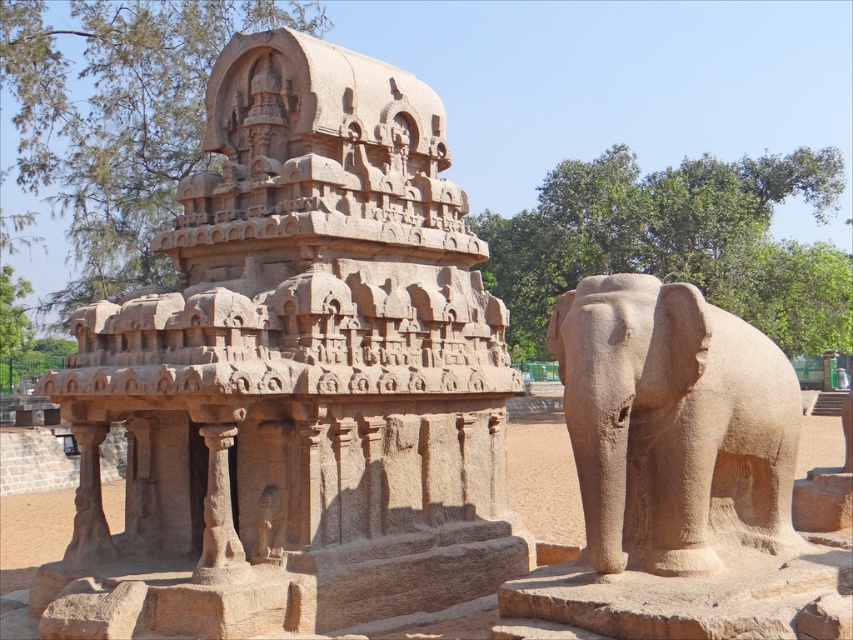
You are an archaeologist examining the ancient stone structures. You notice the sandy stone temple at center and the sandy stone elephant at right. Which structure is closer to your current position?

The sandy stone temple at center is closer to your current position because it is further to the viewer than the sandy stone elephant at right, meaning it appears nearer in the scene.

Consider the image. You are an archaeologist examining the ancient site. You need to place a protective barrier between the sandy stone temple at center and the sandy stone elephant at right. Based on their positions, which direction should the barrier be placed relative to the elephant?

The barrier should be placed to the left of the sandy stone elephant at right because the sandy stone temple at center is located to the left of the sandy stone elephant at right.